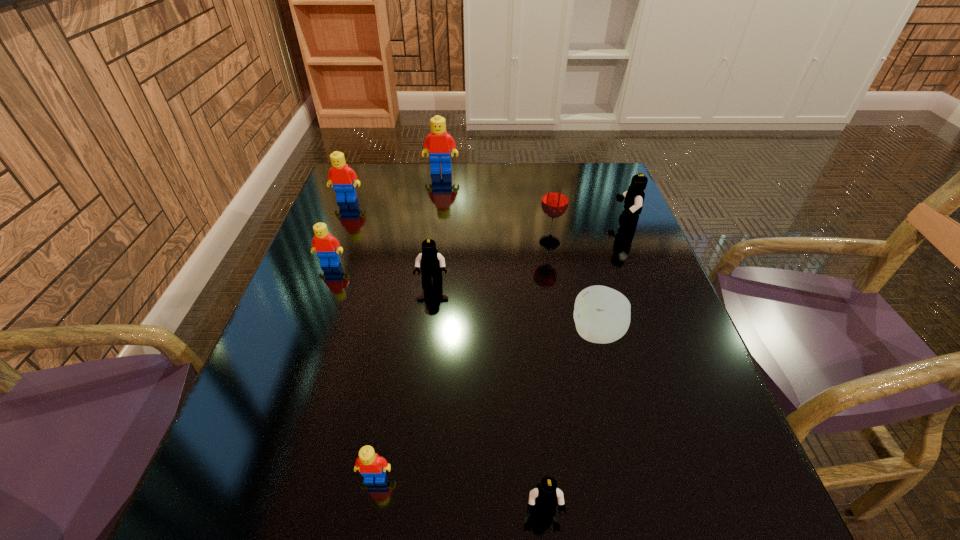
At what (x,y) coordinates should I click in order to perform the action: click on free space located on the front-facing side of the rightmost object. Please return your answer as a coordinate pair (x, y). This screenshot has height=540, width=960. Looking at the image, I should click on (518, 224).

Locate an element on the screen. Image resolution: width=960 pixels, height=540 pixels. free spot located 0.140m on the front-facing side of the rightmost object is located at coordinates (563, 224).

Identify the location of vacant area situated 0.160m on the front-facing side of the rightmost object. (555, 224).

Identify the location of blank space located 0.090m on the face of the sixth nearest Lego. (338, 222).

Identify the location of free point located on the face of the fifth farthest object. This screenshot has height=540, width=960. (316, 304).

Where is `vacant space situated 0.330m on the front-facing side of the second biggest black Lego`? The height and width of the screenshot is (540, 960). vacant space situated 0.330m on the front-facing side of the second biggest black Lego is located at coordinates (416, 423).

Identify the location of free space located on the back of the white apple. Image resolution: width=960 pixels, height=540 pixels. (580, 265).

At what (x,y) coordinates should I click in order to perform the action: click on blank area located on the face of the second nearest object. Please return your answer as a coordinate pair (x, y). The height and width of the screenshot is (540, 960). Looking at the image, I should click on (366, 535).

What are the coordinates of `object located at the near edge` in the screenshot? It's located at (546, 495).

Locate an element on the screen. The height and width of the screenshot is (540, 960). Lego that is at the right edge is located at coordinates (634, 197).